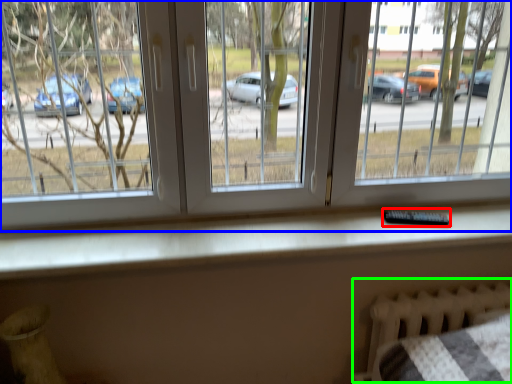
Question: Based on their relative distances, which object is nearer to remote (highlighted by a red box)? Choose from window (highlighted by a blue box) and bed frame (highlighted by a green box).

Choices:
 (A) window
 (B) bed frame

Answer: (B)